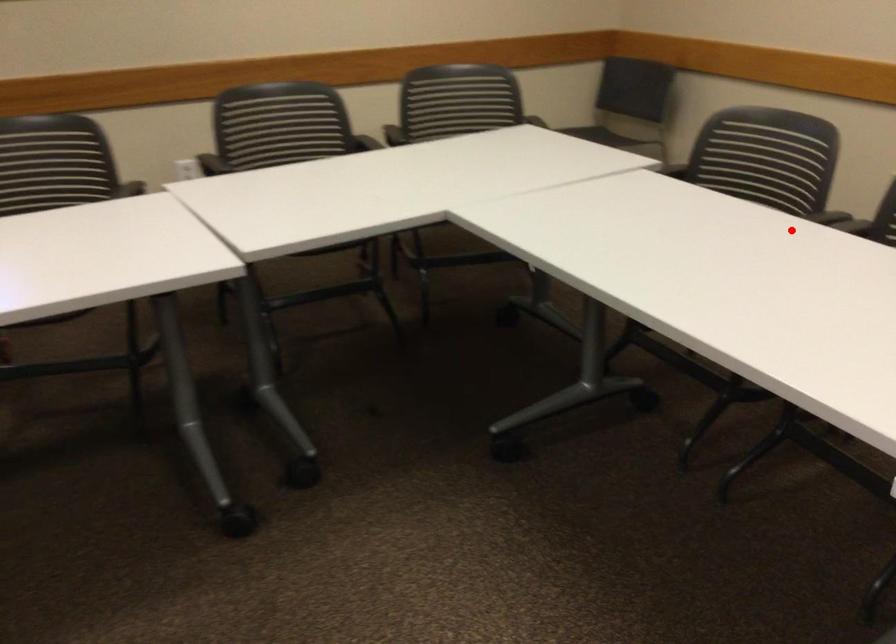
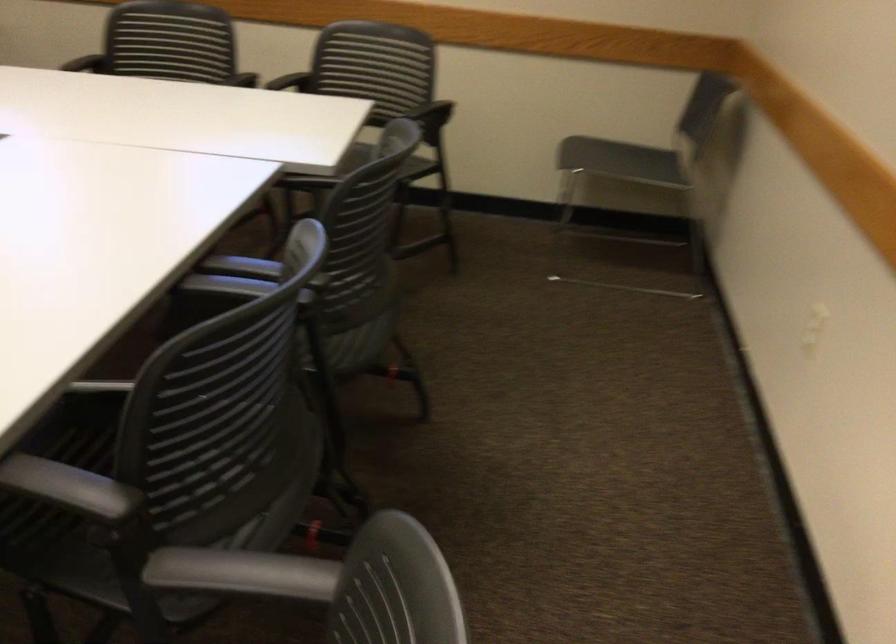
Question: I am providing you with two images of the same scene from different viewpoints. Image1 has a red point marked. In image2, the corresponding 3D location appears at what relative position? Reply with the corresponding letter.

Choices:
 (A) Closer
 (B) Farther

Answer: (A)